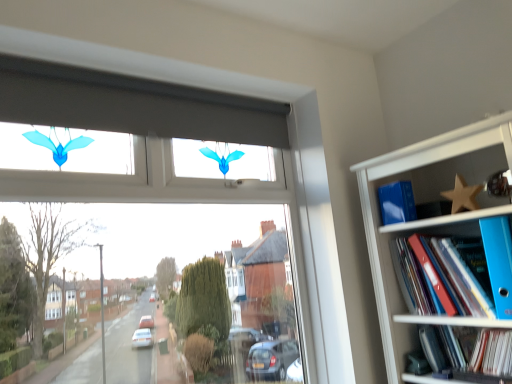
Question: Is blue plastic folder at right, the second paperback book viewed from the left, looking in the opposite direction of blue plastic folders at upper right?

Choices:
 (A) yes
 (B) no

Answer: (A)

Question: Is blue plastic folder at right, placed as the 2th paperback book when sorted from back to front, bigger than blue plastic folders at upper right?

Choices:
 (A) yes
 (B) no

Answer: (B)

Question: From the image's perspective, is blue plastic folder at right, placed as the first paperback book when sorted from right to left, on top of blue plastic folders at upper right?

Choices:
 (A) no
 (B) yes

Answer: (B)

Question: Is blue plastic folder at right, placed as the 2th paperback book when sorted from back to front, behind blue plastic folders at upper right?

Choices:
 (A) no
 (B) yes

Answer: (B)

Question: Is blue plastic folder at right, the second paperback book viewed from the left, to the right of blue plastic folders at upper right from the viewer's perspective?

Choices:
 (A) no
 (B) yes

Answer: (B)

Question: Is blue plastic folder at right, placed as the first paperback book when sorted from right to left, wider than blue plastic folders at upper right?

Choices:
 (A) yes
 (B) no

Answer: (B)

Question: Does blue plastic folder at right, positioned as the 1th paperback book in front-to-back order, have a greater height compared to blue plastic folder at right, the 2th book in the bottom-to-top sequence?

Choices:
 (A) yes
 (B) no

Answer: (A)

Question: From the image's perspective, is blue plastic folder at right, the second paperback book viewed from the left, beneath blue plastic folder at right, acting as the 1th book starting from the top?

Choices:
 (A) no
 (B) yes

Answer: (A)

Question: Is blue plastic folder at right, the second paperback book viewed from the left, at the left side of blue plastic folder at right, acting as the 1th book starting from the top?

Choices:
 (A) no
 (B) yes

Answer: (A)

Question: Considering the relative sizes of blue plastic folder at right, the second paperback book viewed from the left, and blue plastic folder at right, acting as the 1th book starting from the top, in the image provided, is blue plastic folder at right, the second paperback book viewed from the left, wider than blue plastic folder at right, acting as the 1th book starting from the top,?

Choices:
 (A) yes
 (B) no

Answer: (B)

Question: Considering the relative positions of blue plastic folder at right, placed as the 2th paperback book when sorted from back to front, and blue plastic folder at right, the 2th book in the bottom-to-top sequence, in the image provided, is blue plastic folder at right, placed as the 2th paperback book when sorted from back to front, in front of blue plastic folder at right, the 2th book in the bottom-to-top sequence,?

Choices:
 (A) yes
 (B) no

Answer: (A)

Question: Does blue plastic folder at right, placed as the 2th paperback book when sorted from back to front, turn towards blue plastic folder at right, the 2th book in the bottom-to-top sequence?

Choices:
 (A) yes
 (B) no

Answer: (B)

Question: Would you say blue matte book at upper right, placed as the 1th paperback book when sorted from back to front, contains blue plastic folder at right, the 2th book in the bottom-to-top sequence?

Choices:
 (A) no
 (B) yes

Answer: (A)